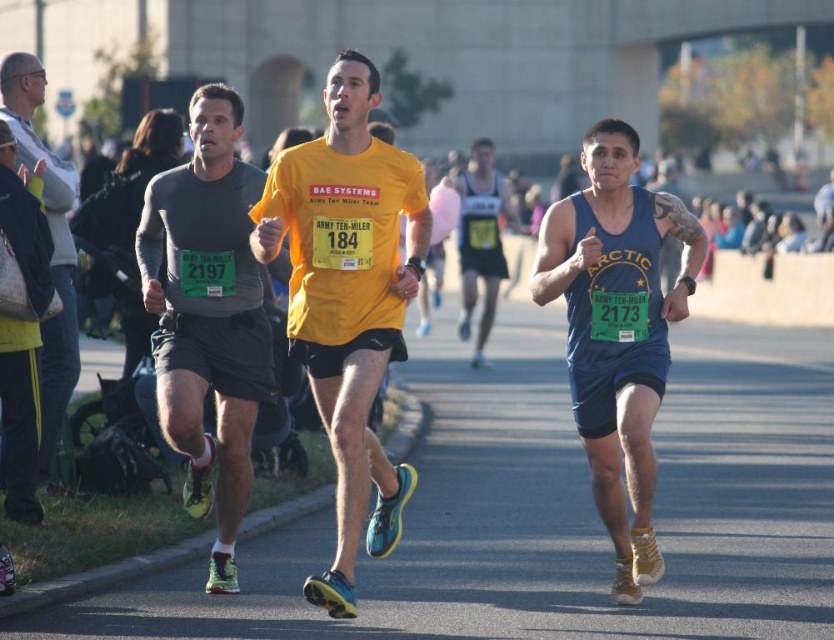
Based on the scene description, where is the matte blue tank top at center located in the image?

The matte blue tank top at center is located at point 0.517 on the x axis and 0.741 on the y axis.

You are a photographer standing at the starting line of the Army Ten Miler. You want to capture a photo of the matte blue tank top at center and the runner wearing the BAE Systems shirt. How far apart are these two runners?

The two runners are 26.22 feet apart.